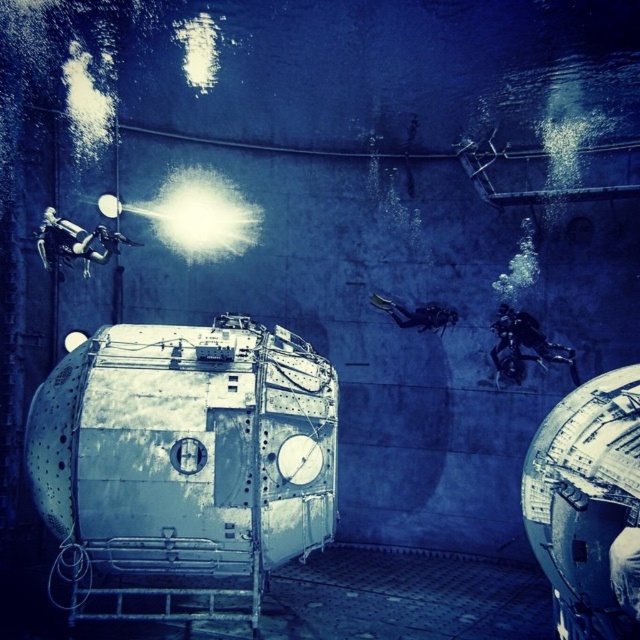
Between metallic industrial tank at center and shiny silver spacesuit at upper left, which one has more height?

With more height is metallic industrial tank at center.

Identify the location of metallic industrial tank at center. The width and height of the screenshot is (640, 640). (182, 461).

Is shiny black spacesuit at right positioned in front of shiny silver spacesuit at upper left?

No, shiny black spacesuit at right is behind shiny silver spacesuit at upper left.

Who is shorter, shiny black spacesuit at right or shiny silver spacesuit at upper left?

shiny silver spacesuit at upper left

At what (x,y) coordinates should I click in order to perform the action: click on shiny black spacesuit at right. Please return your answer as a coordinate pair (x, y). Image resolution: width=640 pixels, height=640 pixels. Looking at the image, I should click on (x=525, y=346).

Find the location of a particular element. The width and height of the screenshot is (640, 640). shiny black spacesuit at right is located at coordinates (525, 346).

What do you see at coordinates (182, 461) in the screenshot?
I see `metallic industrial tank at center` at bounding box center [182, 461].

Is metallic industrial tank at center thinner than shiny black spacesuit at right?

No, metallic industrial tank at center is not thinner than shiny black spacesuit at right.

Does point (273, 406) come in front of point (506, 342)?

Yes, it is.

Locate an element on the screen. Image resolution: width=640 pixels, height=640 pixels. metallic industrial tank at center is located at coordinates (182, 461).